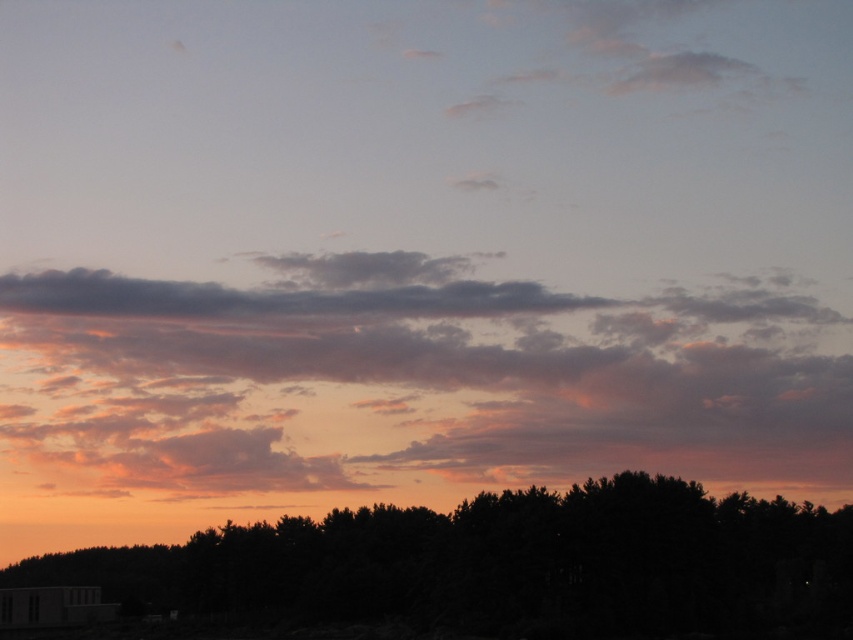
Question: Which of the following is the farthest from the observer?

Choices:
 (A) silhouette tree at lower center
 (B) cloudy sky at upper center

Answer: (B)

Question: Can you confirm if cloudy sky at upper center is positioned below silhouette tree at lower center?

Choices:
 (A) yes
 (B) no

Answer: (B)

Question: Can you confirm if cloudy sky at upper center is smaller than silhouette tree at lower center?

Choices:
 (A) no
 (B) yes

Answer: (B)

Question: Which point is closer to the camera?

Choices:
 (A) silhouette tree at lower center
 (B) cloudy sky at upper center

Answer: (A)

Question: In this image, where is cloudy sky at upper center located relative to silhouette tree at lower center?

Choices:
 (A) above
 (B) below

Answer: (A)